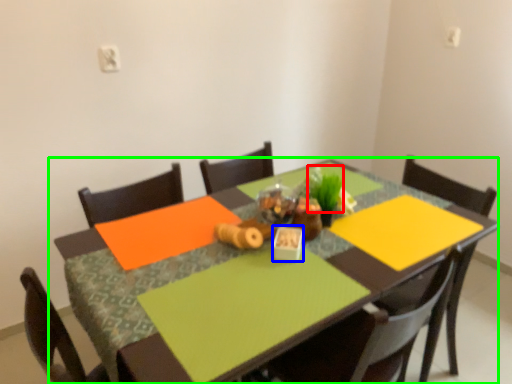
Question: Estimate the real-world distances between objects in this image. Which object is closer to plant (highlighted by a red box), tableware (highlighted by a blue box) or table (highlighted by a green box)?

Choices:
 (A) tableware
 (B) table

Answer: (A)